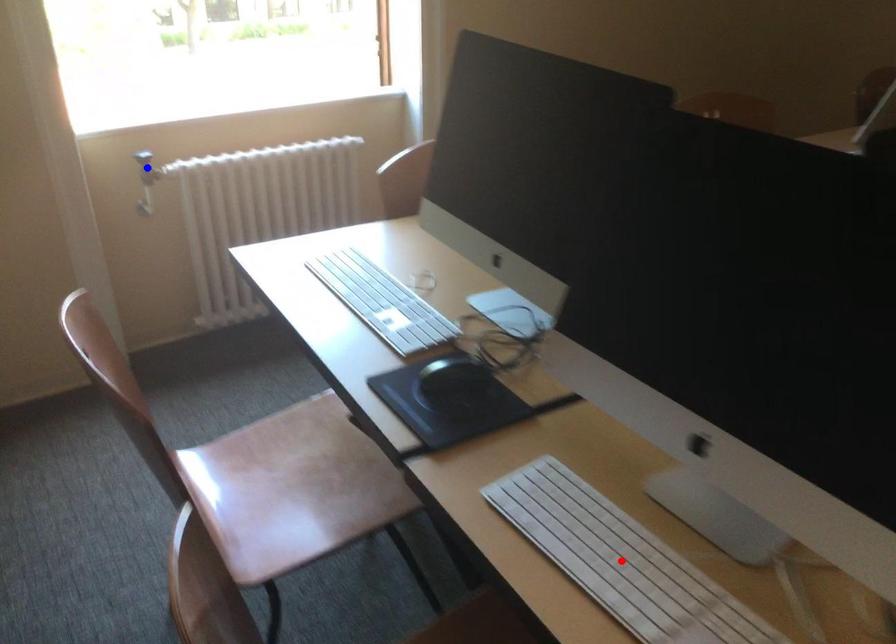
Question: Which of the two points in the image is closer to the camera?

Choices:
 (A) Blue point is closer.
 (B) Red point is closer.

Answer: (B)